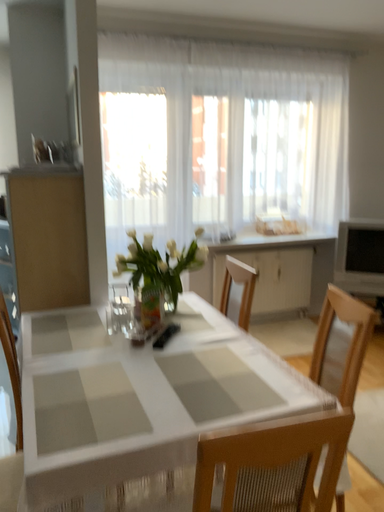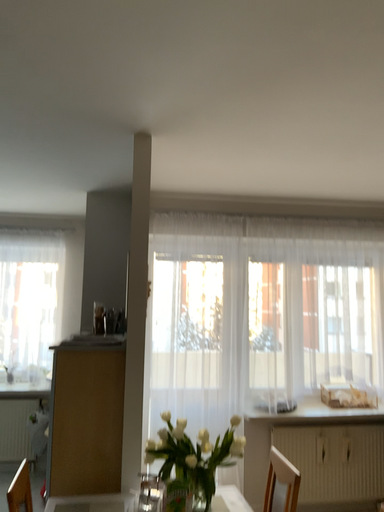
Question: How did the camera likely rotate when shooting the video?

Choices:
 (A) rotated downward
 (B) rotated upward

Answer: (B)